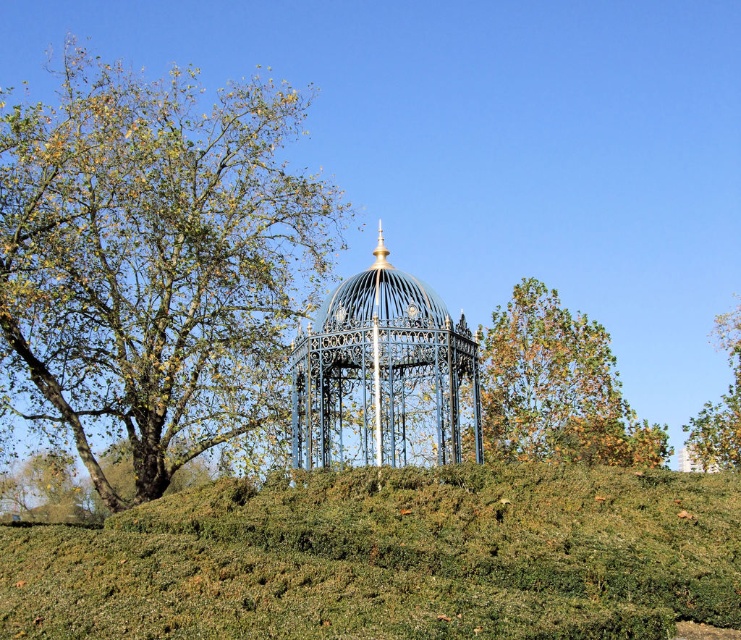
From the picture: Who is higher up, green grassy hill at center or green leafy tree at left?

green leafy tree at left is above.

Does green grassy hill at center appear over green leafy tree at left?

No, green grassy hill at center is not above green leafy tree at left.

Which is behind, point (588, 605) or point (288, 228)?

The point (288, 228) is more distant.

What are the coordinates of `green grassy hill at center` in the screenshot? It's located at (391, 557).

Does point (153, 262) come behind point (737, 445)?

That is False.

Is green leafy tree at left thinner than green leafy tree at upper right?

No.

Locate an element on the screen. The width and height of the screenshot is (741, 640). green leafy tree at left is located at coordinates (153, 260).

Is the position of green leafy tree at left less distant than that of yellow-green foliage at right?

No, it is not.

Where is `green leafy tree at left`? green leafy tree at left is located at coordinates (153, 260).